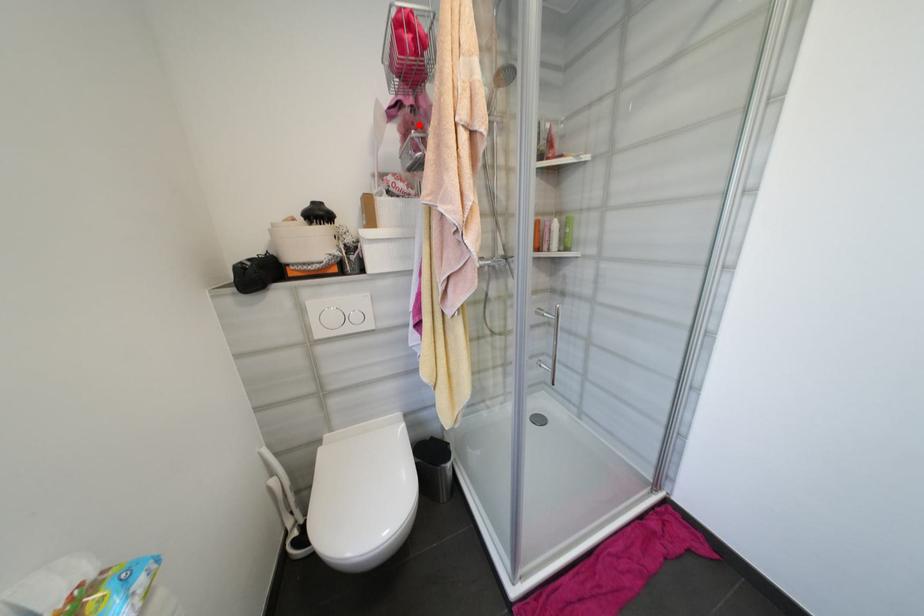
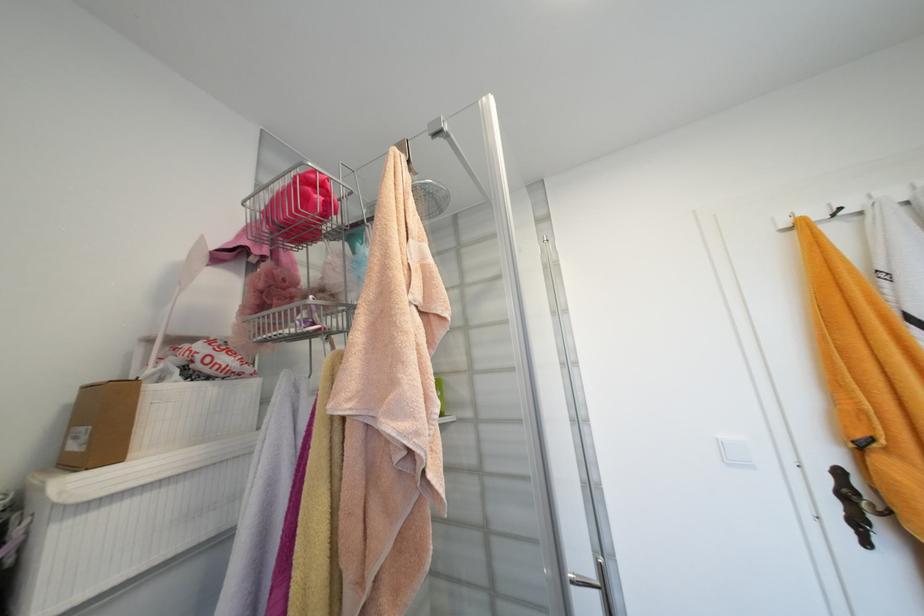
Question: I am providing you with two images of the same scene from different viewpoints. A red point is marked on the first image. At the location where the point appears in image 1, is it still visible in image 2?

Choices:
 (A) Yes
 (B) No

Answer: (A)